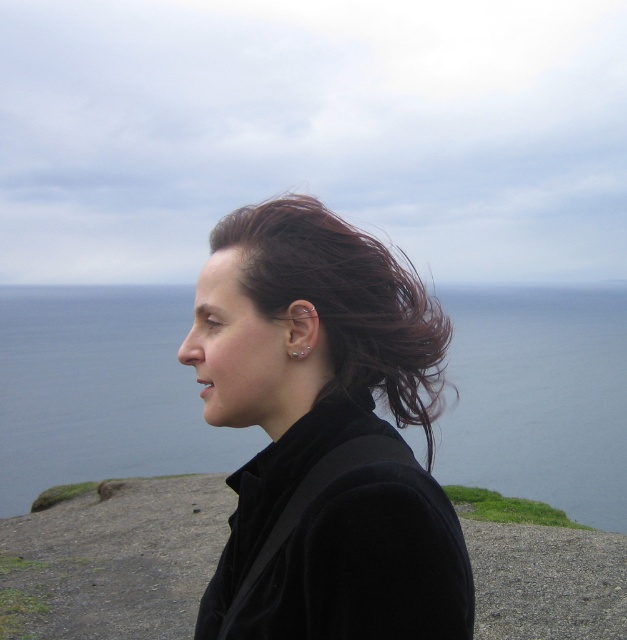
You are a photographer trying to capture the person in the image. Which hair color is positioned lower on the person, the matte black hair at center or the dark brown hair at center?

The matte black hair at center is positioned lower than the dark brown hair at center.

You are standing in the same location as the person in the image. You want to move from your current position to the point labeled point (x=127, y=468). Which direction should you move relative to the point labeled point (x=280, y=323)?

You should move away from the point labeled point (x=280, y=323) because point (x=127, y=468) is further away from the viewer compared to point (x=280, y=323).